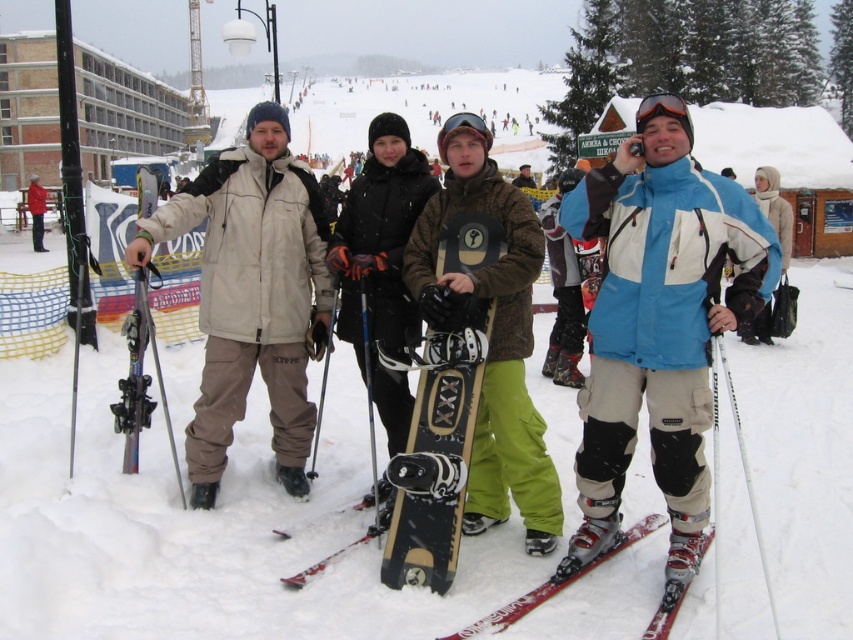
Between shiny metallic skis at lower right and matte black goggles at center, which one is positioned lower?

shiny metallic skis at lower right is lower down.

Does point (508, 614) come behind point (473, 125)?

No, (508, 614) is in front of (473, 125).

Is point (670, 625) closer to viewer compared to point (462, 125)?

Yes, point (670, 625) is in front of point (462, 125).

The width and height of the screenshot is (853, 640). In order to click on shiny metallic skis at lower right in this screenshot , I will do `click(554, 584)`.

Does point (480, 388) come behind point (390, 515)?

No, (480, 388) is closer to viewer.

Does point (482, 440) come farther from viewer compared to point (281, 580)?

Yes, point (482, 440) is behind point (281, 580).

You are a GUI agent. You are given a task and a screenshot of the screen. Output one action in this format:
    pyautogui.click(x=<x>, y=<y>)
    Task: Click on the camouflage-patterned snowboard at center
    
    Given the screenshot: What is the action you would take?
    pyautogui.click(x=492, y=340)

Does matte beige jacket at center have a greater width compared to black matte snowboard at center?

Yes.

This screenshot has width=853, height=640. I want to click on matte beige jacket at center, so click(252, 296).